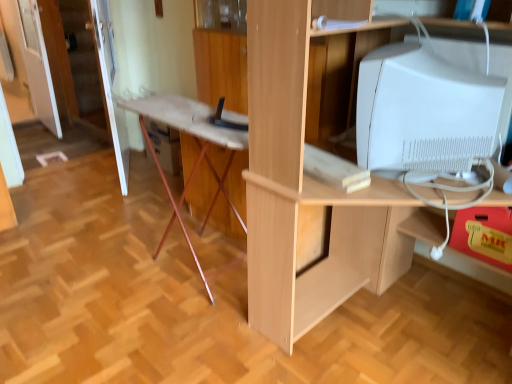
Question: Is white glossy door at upper left, the 1th door positioned from the left, in contact with wooden ironing board at center?

Choices:
 (A) yes
 (B) no

Answer: (B)

Question: Are white glossy door at upper left, the 1th door positioned from the left, and wooden ironing board at center located far from each other?

Choices:
 (A) no
 (B) yes

Answer: (B)

Question: From a real-world perspective, is white glossy door at upper left, the 1th door positioned from the left, beneath wooden ironing board at center?

Choices:
 (A) no
 (B) yes

Answer: (A)

Question: Would you say white glossy door at upper left, marked as the 2th door in a right-to-left arrangement, is outside wooden ironing board at center?

Choices:
 (A) yes
 (B) no

Answer: (A)

Question: Can you confirm if white glossy door at upper left, the 1th door positioned from the left, is shorter than wooden ironing board at center?

Choices:
 (A) yes
 (B) no

Answer: (B)

Question: Would you say transparent glass door at upper left is to the left or to the right of yellow matte drawer at lower right in the picture?

Choices:
 (A) right
 (B) left

Answer: (B)

Question: Does point (36, 89) appear closer or farther from the camera than point (455, 238)?

Choices:
 (A) farther
 (B) closer

Answer: (A)

Question: From a real-world perspective, is transparent glass door at upper left above or below yellow matte drawer at lower right?

Choices:
 (A) below
 (B) above

Answer: (B)

Question: Is transparent glass door at upper left wider or thinner than yellow matte drawer at lower right?

Choices:
 (A) wide
 (B) thin

Answer: (B)

Question: Considering their positions, is white glossy computer monitor at upper right located in front of or behind wooden ironing board at center?

Choices:
 (A) behind
 (B) front

Answer: (B)

Question: Considering the positions of point (388, 148) and point (133, 102), is point (388, 148) closer or farther from the camera than point (133, 102)?

Choices:
 (A) farther
 (B) closer

Answer: (B)

Question: In terms of size, does white glossy computer monitor at upper right appear bigger or smaller than wooden ironing board at center?

Choices:
 (A) small
 (B) big

Answer: (A)

Question: In terms of height, does white glossy computer monitor at upper right look taller or shorter compared to wooden ironing board at center?

Choices:
 (A) short
 (B) tall

Answer: (A)

Question: From a real-world perspective, is white glossy door at upper left, the 2th door positioned from the left, positioned above or below white glossy computer monitor at upper right?

Choices:
 (A) below
 (B) above

Answer: (A)

Question: Is white glossy door at upper left, the 2th door positioned from the left, inside the boundaries of white glossy computer monitor at upper right, or outside?

Choices:
 (A) outside
 (B) inside

Answer: (A)